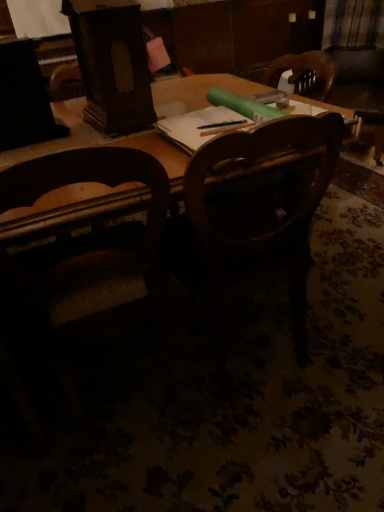
Describe the element at coordinates (353, 24) in the screenshot. I see `plaid fabric at upper right` at that location.

Where is `wooden chair at left, the first chair positioned from the left`? wooden chair at left, the first chair positioned from the left is located at coordinates (92, 251).

How many degrees apart are the facing directions of wooden chair at left, the first chair positioned from the left, and wooden chair at center, the second chair from the left?

The angular difference between wooden chair at left, the first chair positioned from the left, and wooden chair at center, the second chair from the left, is 84.5 degrees.

Where is `chair in front of the wooden chair at center, the second chair from the left`? Image resolution: width=384 pixels, height=512 pixels. chair in front of the wooden chair at center, the second chair from the left is located at coordinates (92, 251).

Consider the image. Is wooden chair at center, positioned as the first chair in right-to-left order, a part of wooden chair at left, placed as the second chair when sorted from right to left?

No.

Is wooden chair at left, placed as the second chair when sorted from right to left, positioned far away from wooden chair at center, positioned as the first chair in right-to-left order?

wooden chair at left, placed as the second chair when sorted from right to left, is near wooden chair at center, positioned as the first chair in right-to-left order, not far away.

Does wooden chair at center, the second chair from the left, turn towards plaid fabric at upper right?

No, wooden chair at center, the second chair from the left, is not turned towards plaid fabric at upper right.

Based on the photo, considering the relative sizes of wooden chair at center, positioned as the first chair in right-to-left order, and plaid fabric at upper right in the image provided, is wooden chair at center, positioned as the first chair in right-to-left order, taller than plaid fabric at upper right?

Yes.

From a real-world perspective, who is located lower, wooden chair at center, the second chair from the left, or plaid fabric at upper right?

In real-world perspective, wooden chair at center, the second chair from the left, is lower.

Locate an element on the screen. The image size is (384, 512). chair below the wooden chair at center, positioned as the first chair in right-to-left order (from the image's perspective) is located at coordinates (92, 251).

From the image's perspective, is wooden chair at center, positioned as the first chair in right-to-left order, on top of wooden chair at left, the first chair positioned from the left?

Indeed, from the image's perspective, wooden chair at center, positioned as the first chair in right-to-left order, is shown above wooden chair at left, the first chair positioned from the left.

Looking at this image, which of these two, wooden chair at center, the second chair from the left, or wooden chair at left, the first chair positioned from the left, is wider?

With larger width is wooden chair at center, the second chair from the left.

Considering the sizes of wooden chair at center, the second chair from the left, and wooden chair at left, placed as the second chair when sorted from right to left, in the image, is wooden chair at center, the second chair from the left, bigger or smaller than wooden chair at left, placed as the second chair when sorted from right to left,?

Considering their sizes, wooden chair at center, the second chair from the left, takes up more space than wooden chair at left, placed as the second chair when sorted from right to left.

In terms of width, does plaid fabric at upper right look wider or thinner when compared to wooden chair at center, the second chair from the left?

In the image, plaid fabric at upper right appears to be more narrow than wooden chair at center, the second chair from the left.

Consider the image. Is plaid fabric at upper right facing away from wooden chair at center, positioned as the first chair in right-to-left order?

No, plaid fabric at upper right's orientation is not away from wooden chair at center, positioned as the first chair in right-to-left order.

Based on the photo, from a real-world perspective, relative to wooden chair at center, positioned as the first chair in right-to-left order, is plaid fabric at upper right vertically above or below?

From a real-world perspective, plaid fabric at upper right is physically above wooden chair at center, positioned as the first chair in right-to-left order.

Could you measure the distance between plaid fabric at upper right and wooden chair at center, positioned as the first chair in right-to-left order?

plaid fabric at upper right is 7.38 feet away from wooden chair at center, positioned as the first chair in right-to-left order.

Does plaid fabric at upper right have a larger size compared to wooden chair at left, placed as the second chair when sorted from right to left?

No, plaid fabric at upper right is not bigger than wooden chair at left, placed as the second chair when sorted from right to left.

Is plaid fabric at upper right inside or outside of wooden chair at left, the first chair positioned from the left?

plaid fabric at upper right cannot be found inside wooden chair at left, the first chair positioned from the left.

You are a GUI agent. You are given a task and a screenshot of the screen. Output one action in this format:
    pyautogui.click(x=<x>, y=<y>)
    Task: Click on the chair that is the 2nd object located in front of the plaid fabric at upper right
    
    Given the screenshot: What is the action you would take?
    pyautogui.click(x=92, y=251)

Can you tell me how much plaid fabric at upper right and wooden chair at left, placed as the second chair when sorted from right to left, differ in facing direction?

plaid fabric at upper right and wooden chair at left, placed as the second chair when sorted from right to left, are facing 130 degrees away from each other.

Considering the positions of objects wooden chair at left, placed as the second chair when sorted from right to left, and plaid fabric at upper right in the image provided, who is in front, wooden chair at left, placed as the second chair when sorted from right to left, or plaid fabric at upper right?

wooden chair at left, placed as the second chair when sorted from right to left, is closer to the camera.

Is wooden chair at left, the first chair positioned from the left, outside of plaid fabric at upper right?

Absolutely, wooden chair at left, the first chair positioned from the left, is external to plaid fabric at upper right.

Is wooden chair at left, placed as the second chair when sorted from right to left, placed right next to plaid fabric at upper right?

No, wooden chair at left, placed as the second chair when sorted from right to left, is not next to plaid fabric at upper right.

Identify the location of chair above the wooden chair at left, the first chair positioned from the left (from the image's perspective). (257, 159).

Where is `the 1st chair to the left of the plaid fabric at upper right, starting your count from the anchor`? The width and height of the screenshot is (384, 512). the 1st chair to the left of the plaid fabric at upper right, starting your count from the anchor is located at coordinates (257, 159).

Considering their positions, is plaid fabric at upper right positioned closer to wooden chair at left, the first chair positioned from the left, than wooden chair at center, the second chair from the left?

Among the two, wooden chair at center, the second chair from the left, is located nearer to wooden chair at left, the first chair positioned from the left.

Estimate the real-world distances between objects in this image. Which object is further from wooden chair at left, placed as the second chair when sorted from right to left, wooden chair at center, the second chair from the left, or plaid fabric at upper right?

plaid fabric at upper right lies further to wooden chair at left, placed as the second chair when sorted from right to left, than the other object.

Which object lies nearer to the anchor point wooden chair at center, positioned as the first chair in right-to-left order, plaid fabric at upper right or wooden chair at left, the first chair positioned from the left?

wooden chair at left, the first chair positioned from the left, lies closer to wooden chair at center, positioned as the first chair in right-to-left order, than the other object.

Based on their spatial positions, is wooden chair at left, placed as the second chair when sorted from right to left, or plaid fabric at upper right closer to wooden chair at center, the second chair from the left?

wooden chair at left, placed as the second chair when sorted from right to left, lies closer to wooden chair at center, the second chair from the left, than the other object.

Which object lies nearer to the anchor point plaid fabric at upper right, wooden chair at center, positioned as the first chair in right-to-left order, or wooden chair at left, the first chair positioned from the left?

wooden chair at center, positioned as the first chair in right-to-left order, is positioned closer to the anchor plaid fabric at upper right.

Considering their positions, is wooden chair at left, placed as the second chair when sorted from right to left, positioned closer to plaid fabric at upper right than wooden chair at center, positioned as the first chair in right-to-left order?

Among the two, wooden chair at center, positioned as the first chair in right-to-left order, is located nearer to plaid fabric at upper right.

At what (x,y) coordinates should I click in order to perform the action: click on chair between wooden chair at left, the first chair positioned from the left, and plaid fabric at upper right from front to back. Please return your answer as a coordinate pair (x, y). Looking at the image, I should click on (257, 159).